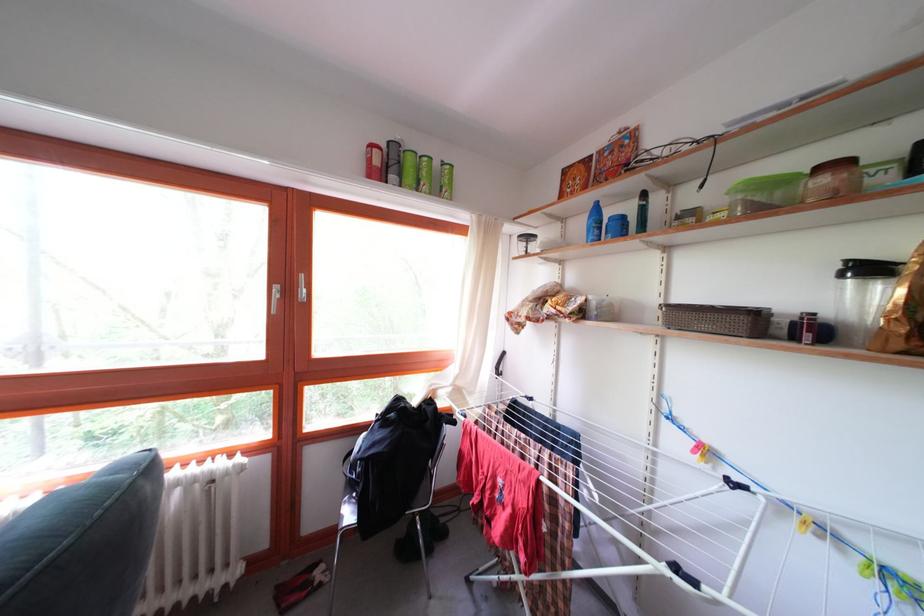
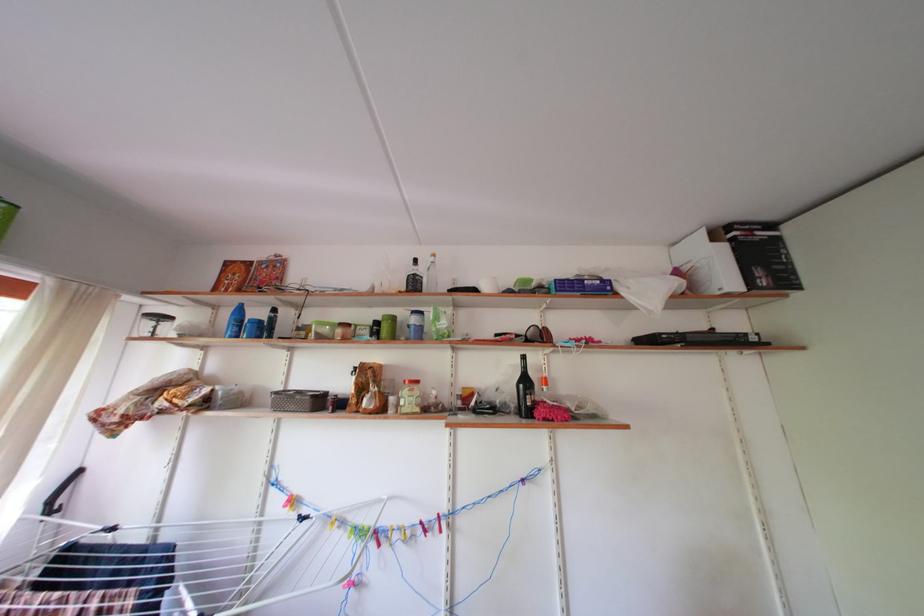
In the second image, find the point that corresponds to (825,543) in the first image.

(346, 535)